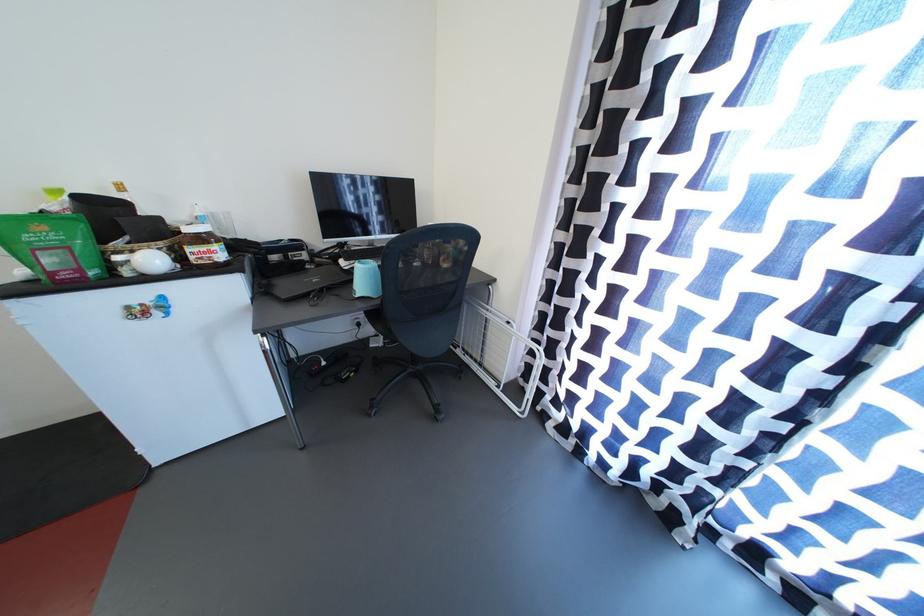
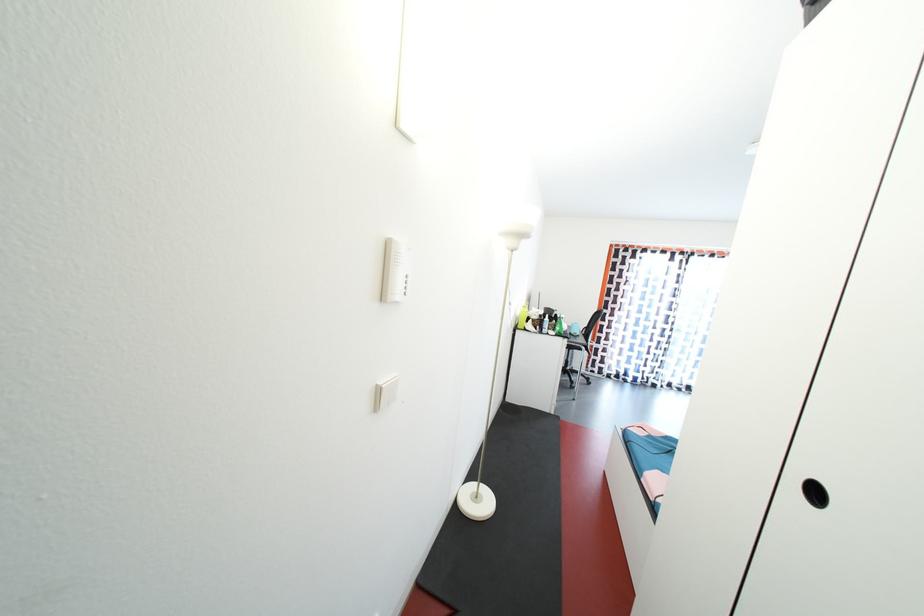
Question: I am providing you with two images of the same scene from different viewpoints. After the viewpoint changes to image2, which objects are now occluded?

Choices:
 (A) green spray bottle
 (B) intercom buttons
 (C) white filament spool
 (D) wicker basket

Answer: (D)